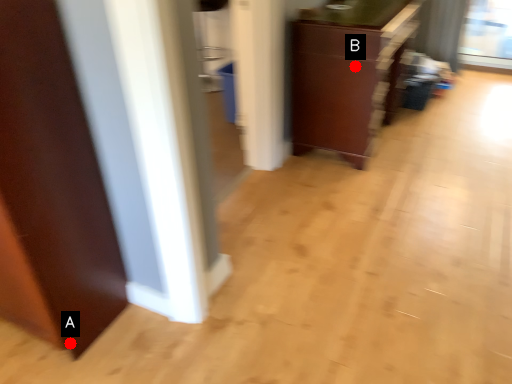
Question: Two points are circled on the image, labeled by A and B beside each circle. Which of the following is the farthest from the observer?

Choices:
 (A) A is further
 (B) B is further

Answer: (B)